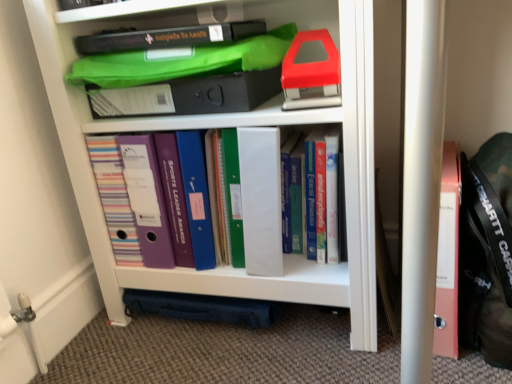
Question: Is hardcover books at center, which is the 3th book from left to right, aimed at matte plastic folders at center, the 3th book viewed from the right?

Choices:
 (A) yes
 (B) no

Answer: (B)

Question: Is hardcover books at center, which is the 1th book in right-to-left order, shorter than matte plastic folders at center, the 1th book from the left?

Choices:
 (A) yes
 (B) no

Answer: (B)

Question: Is hardcover books at center, which is the 1th book in right-to-left order, not inside matte plastic folders at center, the 3th book viewed from the right?

Choices:
 (A) yes
 (B) no

Answer: (A)

Question: From a real-world perspective, is hardcover books at center, which is the 3th book from left to right, over matte plastic folders at center, the 1th book from the left?

Choices:
 (A) yes
 (B) no

Answer: (A)

Question: From a real-world perspective, is hardcover books at center, which is the 1th book in right-to-left order, located beneath matte plastic folders at center, the 3th book viewed from the right?

Choices:
 (A) no
 (B) yes

Answer: (A)

Question: In the image, is matte plastic folders at center, the 3th book viewed from the right, positioned in front of or behind red plastic stapler at upper right, the 2th book viewed from the right?

Choices:
 (A) behind
 (B) front

Answer: (A)

Question: Does point (172, 210) appear closer or farther from the camera than point (294, 43)?

Choices:
 (A) farther
 (B) closer

Answer: (A)

Question: From the image's perspective, is matte plastic folders at center, the 1th book from the left, located above or below red plastic stapler at upper right, the 2th book viewed from the right?

Choices:
 (A) below
 (B) above

Answer: (A)

Question: In terms of height, does matte plastic folders at center, the 1th book from the left, look taller or shorter compared to red plastic stapler at upper right, which appears as the 2th book when viewed from the left?

Choices:
 (A) tall
 (B) short

Answer: (A)

Question: Is white plastic shelf at center in front of or behind hardcover books at center, which is the 3th book from left to right, in the image?

Choices:
 (A) front
 (B) behind

Answer: (A)

Question: Is white plastic shelf at center inside or outside of hardcover books at center, which is the 3th book from left to right?

Choices:
 (A) inside
 (B) outside

Answer: (B)

Question: Considering the positions of white plastic shelf at center and hardcover books at center, which is the 1th book in right-to-left order, in the image, is white plastic shelf at center bigger or smaller than hardcover books at center, which is the 1th book in right-to-left order,?

Choices:
 (A) small
 (B) big

Answer: (B)

Question: Looking at their shapes, would you say white plastic shelf at center is wider or thinner than hardcover books at center, which is the 1th book in right-to-left order?

Choices:
 (A) thin
 (B) wide

Answer: (B)

Question: Is white plastic shelf at center inside or outside of red plastic stapler at upper right, the 2th book viewed from the right?

Choices:
 (A) inside
 (B) outside

Answer: (B)

Question: Is white plastic shelf at center in front of or behind red plastic stapler at upper right, which appears as the 2th book when viewed from the left, in the image?

Choices:
 (A) behind
 (B) front

Answer: (B)